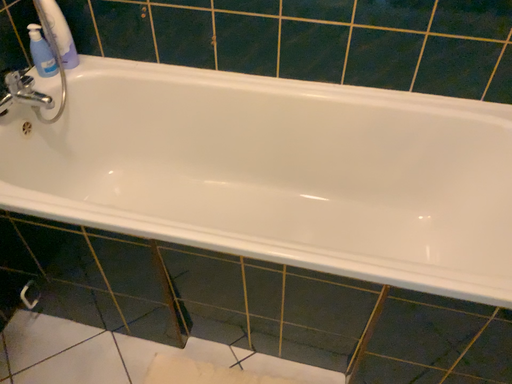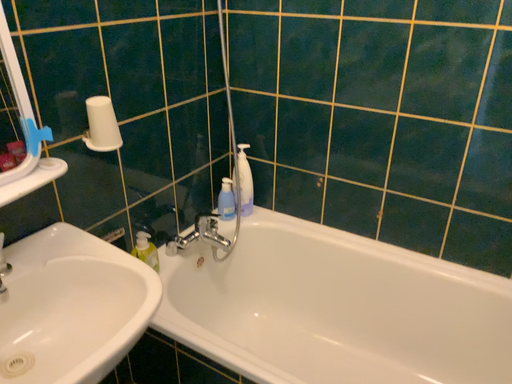
Question: Which way did the camera rotate in the video?

Choices:
 (A) rotated downward
 (B) rotated upward

Answer: (B)